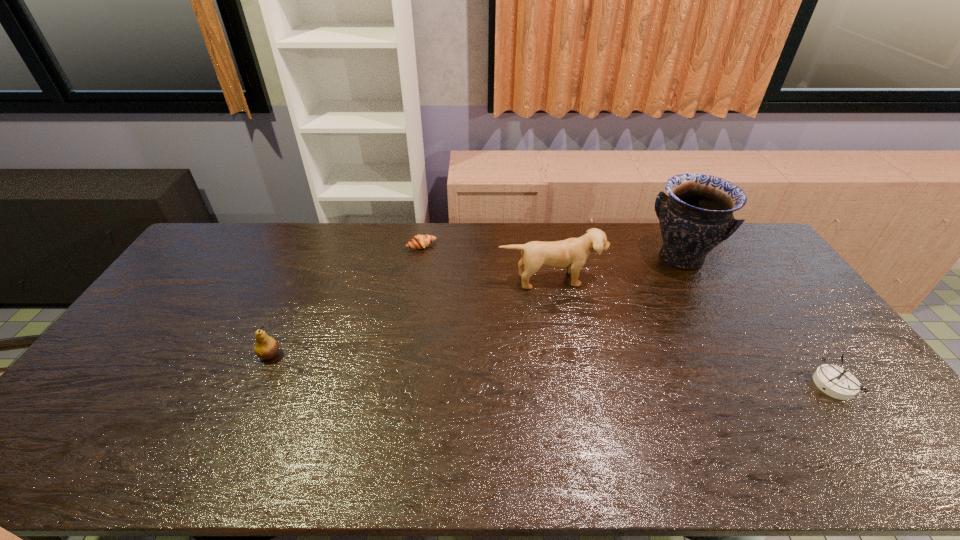
At what (x,y) coordinates should I click in order to perform the action: click on pear. Please return your answer as a coordinate pair (x, y). This screenshot has width=960, height=540. Looking at the image, I should click on (266, 347).

The width and height of the screenshot is (960, 540). Find the location of `the second nearest object`. the second nearest object is located at coordinates pyautogui.click(x=266, y=347).

Identify the location of compass. (833, 380).

This screenshot has width=960, height=540. I want to click on the nearest object, so click(x=833, y=380).

Where is `the second object from right to left`? This screenshot has height=540, width=960. the second object from right to left is located at coordinates (697, 215).

Where is `pottery`? pottery is located at coordinates (697, 215).

Identify the location of puppy. The height and width of the screenshot is (540, 960). (572, 253).

This screenshot has width=960, height=540. I want to click on the third object from right to left, so click(x=572, y=253).

Image resolution: width=960 pixels, height=540 pixels. In order to click on the shortest object in this screenshot , I will do `click(419, 241)`.

This screenshot has height=540, width=960. In order to click on pastry in this screenshot , I will do point(419,241).